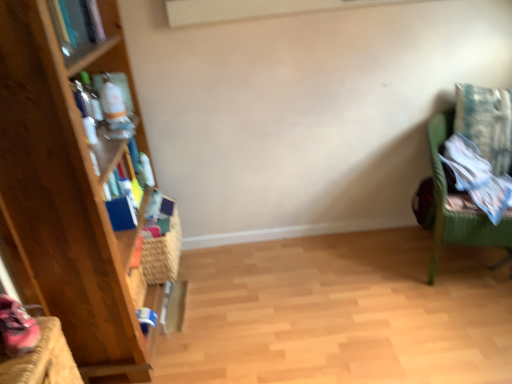
Question: From a real-world perspective, is wooden bookcase at left positioned above or below woven straw basket at left?

Choices:
 (A) above
 (B) below

Answer: (A)

Question: Is wooden bookcase at left to the left or to the right of woven straw basket at left in the image?

Choices:
 (A) left
 (B) right

Answer: (A)

Question: Which object is positioned closest to the wooden bookcase at left?

Choices:
 (A) matte blue book at upper left
 (B) woven straw basket at left
 (C) green wicker chair at right

Answer: (B)

Question: Which object is positioned farthest from the green wicker chair at right?

Choices:
 (A) woven straw basket at left
 (B) matte blue book at upper left
 (C) wooden bookcase at left

Answer: (B)